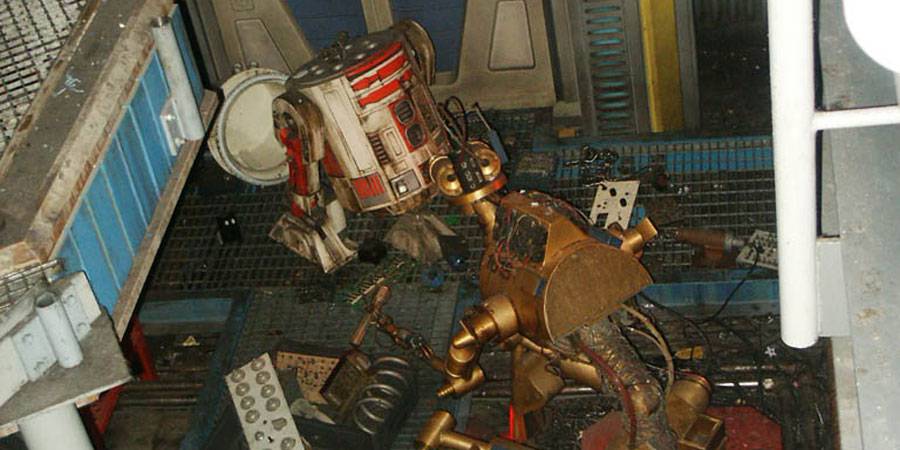
Where is `hinge`? The image size is (900, 450). hinge is located at coordinates (52, 325).